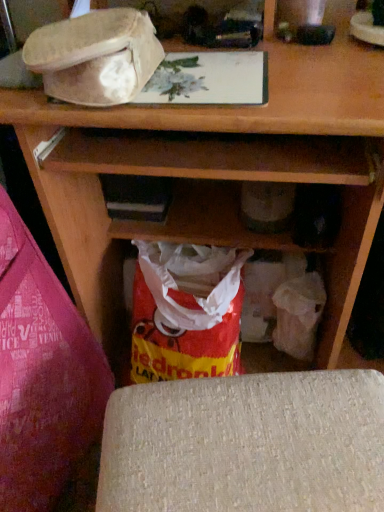
Question: From a real-world perspective, is red plastic bag at lower left physically below red plastic grocery bag at lower center?

Choices:
 (A) yes
 (B) no

Answer: (B)

Question: Is red plastic bag at lower left completely or partially outside of red plastic grocery bag at lower center?

Choices:
 (A) no
 (B) yes

Answer: (B)

Question: Is there a large distance between red plastic bag at lower left and red plastic grocery bag at lower center?

Choices:
 (A) yes
 (B) no

Answer: (B)

Question: From the image's perspective, is red plastic bag at lower left located beneath red plastic grocery bag at lower center?

Choices:
 (A) yes
 (B) no

Answer: (A)

Question: Is the depth of red plastic bag at lower left less than that of red plastic grocery bag at lower center?

Choices:
 (A) no
 (B) yes

Answer: (B)

Question: Can you confirm if red plastic bag at lower left is bigger than red plastic grocery bag at lower center?

Choices:
 (A) yes
 (B) no

Answer: (A)

Question: Considering the relative positions of fuzzy beige hat at upper left and red plastic grocery bag at lower center in the image provided, is fuzzy beige hat at upper left to the left of red plastic grocery bag at lower center from the viewer's perspective?

Choices:
 (A) yes
 (B) no

Answer: (A)

Question: Could you tell me if fuzzy beige hat at upper left is turned towards red plastic grocery bag at lower center?

Choices:
 (A) no
 (B) yes

Answer: (A)

Question: Is fuzzy beige hat at upper left in contact with red plastic grocery bag at lower center?

Choices:
 (A) yes
 (B) no

Answer: (B)

Question: Considering the relative sizes of fuzzy beige hat at upper left and red plastic grocery bag at lower center in the image provided, is fuzzy beige hat at upper left bigger than red plastic grocery bag at lower center?

Choices:
 (A) no
 (B) yes

Answer: (A)

Question: Does fuzzy beige hat at upper left have a lesser width compared to red plastic grocery bag at lower center?

Choices:
 (A) no
 (B) yes

Answer: (B)

Question: Is fuzzy beige hat at upper left oriented away from red plastic grocery bag at lower center?

Choices:
 (A) yes
 (B) no

Answer: (B)

Question: Is red plastic bag at lower left at the left side of textured beige cushion at lower center?

Choices:
 (A) yes
 (B) no

Answer: (A)